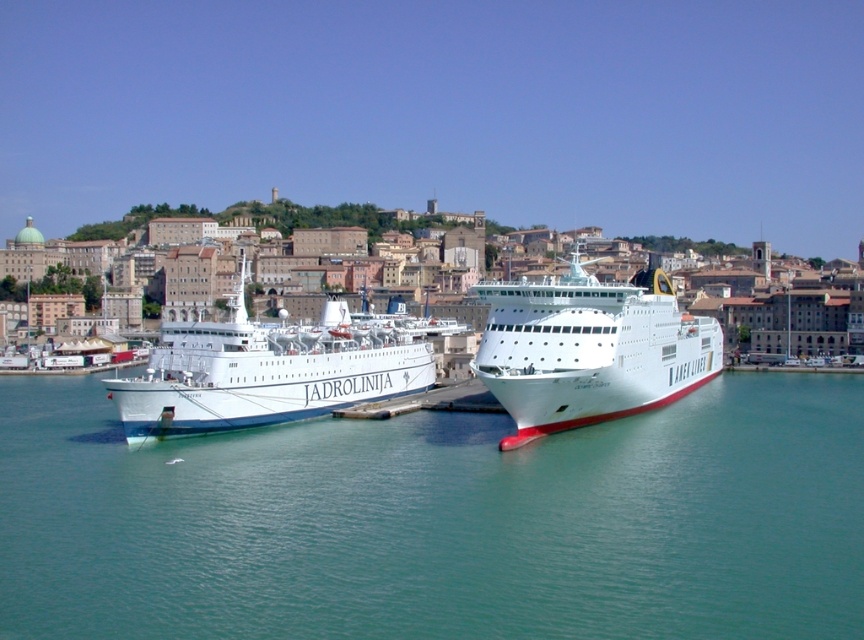
You are standing on the dock and want to take a photo of the clear blue water at center. Where should you position yourself to capture the water in the center of your camera frame?

Position yourself directly in front of the clear blue water at center, which is located at coordinates 0.816 on the x axis and 0.509 on the y axis, to ensure it is centered in your camera frame.

You are a photographer planning to capture the harbor scene. You want to ensure that both the clear blue water at center and the white glossy ship at center are visible in your shot. Based on their relative heights, which object will appear smaller in the photograph?

The clear blue water at center has a lesser height compared to the white glossy ship at center, so the clear blue water at center will appear smaller in the photograph.